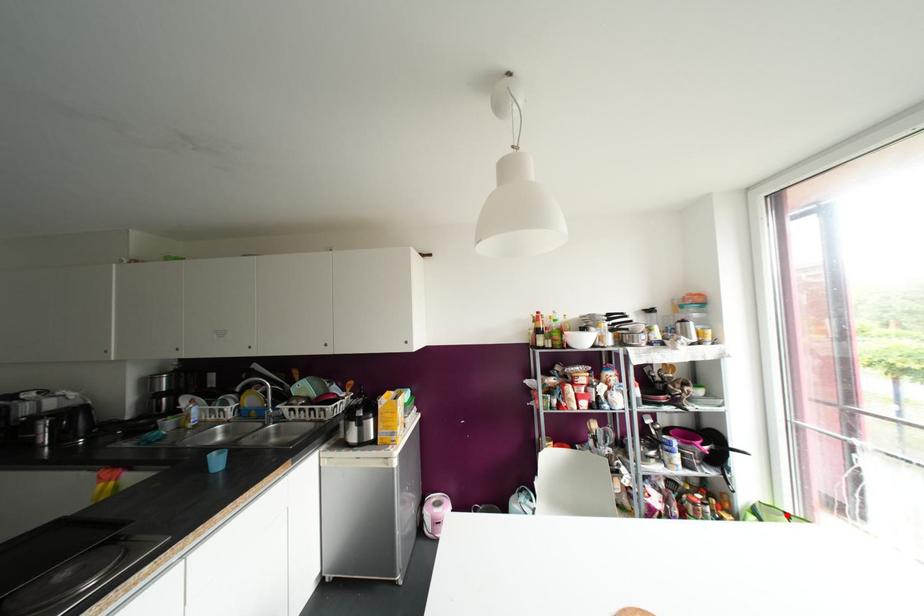
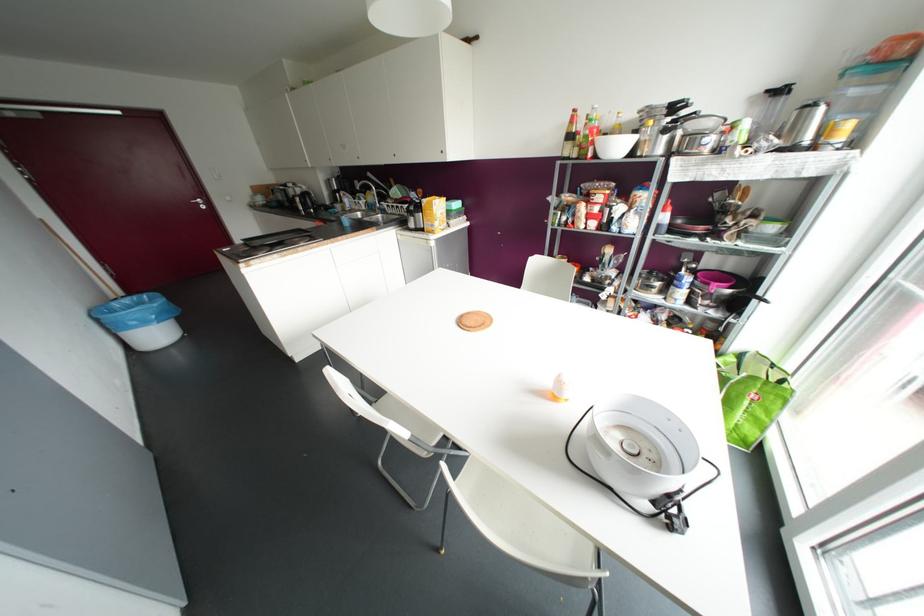
Question: I am providing you with two images of the same scene from different viewpoints. A red point is shown in image1. For the corresponding object point in image2, is it positioned nearer or farther from the camera?

Choices:
 (A) Nearer
 (B) Farther

Answer: (B)